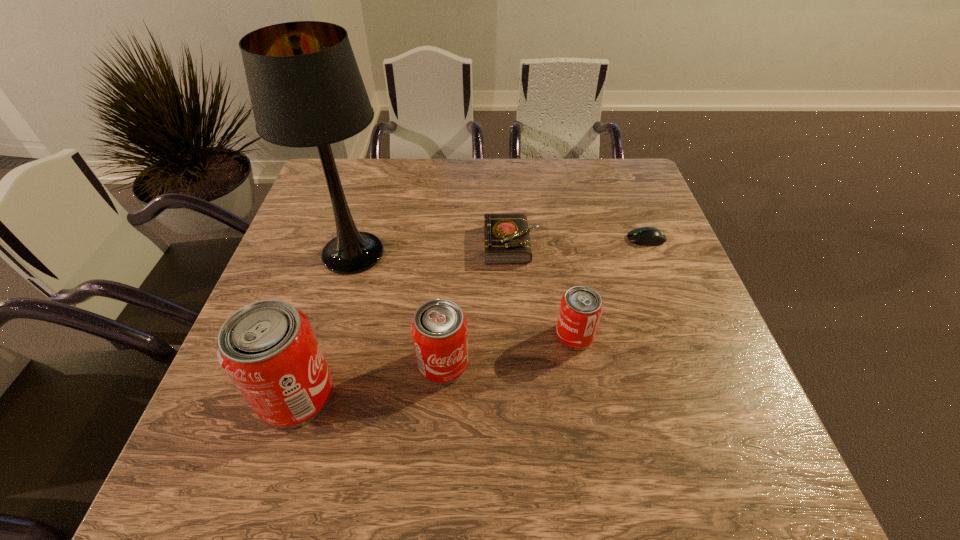
What are the coordinates of `the leftmost can` in the screenshot? It's located at (268, 348).

What are the coordinates of `the tallest can` in the screenshot? It's located at (268, 348).

This screenshot has height=540, width=960. Find the location of `the fourth object from right to left`. the fourth object from right to left is located at coordinates (439, 328).

The height and width of the screenshot is (540, 960). In order to click on the third tallest object in this screenshot , I will do `click(439, 328)`.

This screenshot has height=540, width=960. In order to click on the rightmost can in this screenshot , I will do `click(581, 307)`.

At what (x,y) coordinates should I click in order to perform the action: click on the third shortest object. Please return your answer as a coordinate pair (x, y). Looking at the image, I should click on [581, 307].

Locate an element on the screen. the shortest object is located at coordinates (647, 236).

Where is `the rightmost object`? the rightmost object is located at coordinates (647, 236).

Find the location of a particular element. table lamp is located at coordinates (306, 90).

This screenshot has height=540, width=960. Identify the location of the second shortest object. (507, 241).